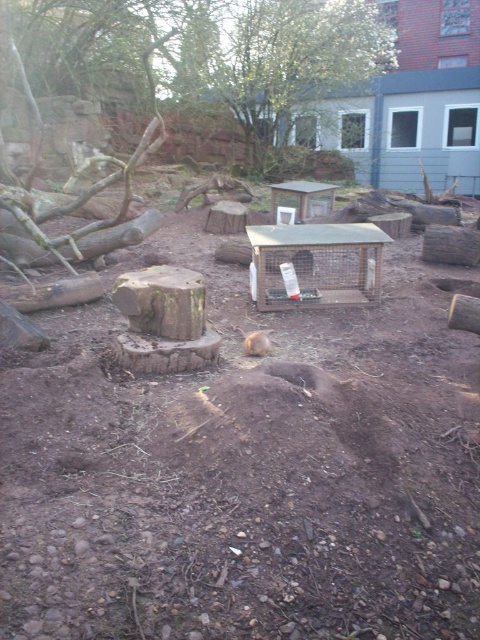
You are a zookeeper who wants to place a new feeding tray for the animal in the wooden cage at center. The current feeding tray is located at the point marked by the coordinates point (247,474). Is the current feeding tray placed on the brown soil at center?

The brown soil at center is represented by point (247,474), so the current feeding tray is placed on the brown soil at center.

You are a zookeeper who needs to place a new feeding tray for the brown furry animal at center. The tray must be placed on the brown soil at center. Can you place the tray directly in front of the animal without moving it?

The brown soil at center is closer to the viewer than the brown furry animal at center, so yes, you can place the feeding tray directly in front of the brown furry animal at center on the brown soil at center since the soil is nearer to you.